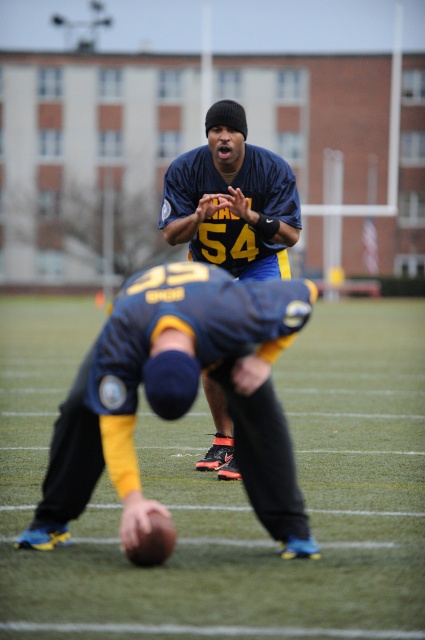
Question: Which object is positioned farthest from the matte blue jersey at center?

Choices:
 (A) green artificial turf at center
 (B) dark blue jersey at lower center

Answer: (A)

Question: Is dark blue jersey at lower center wider than matte blue jersey at center?

Choices:
 (A) no
 (B) yes

Answer: (B)

Question: Which point is farther from the camera taking this photo?

Choices:
 (A) (291, 236)
 (B) (170, 264)

Answer: (A)

Question: Considering the real-world distances, which object is farthest from the green artificial turf at center?

Choices:
 (A) matte blue jersey at center
 (B) dark blue jersey at lower center

Answer: (B)

Question: Is dark blue jersey at lower center bigger than matte blue jersey at center?

Choices:
 (A) no
 (B) yes

Answer: (B)

Question: Is the position of green artificial turf at center less distant than that of dark blue jersey at lower center?

Choices:
 (A) no
 (B) yes

Answer: (B)